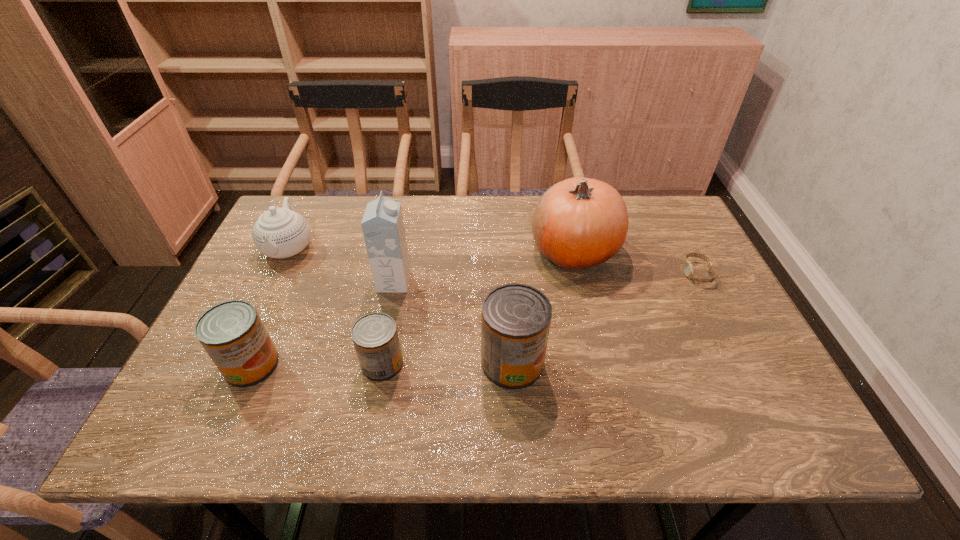
I want to click on free space located 0.150m on the back of the second tallest can, so click(282, 297).

Find the location of `free space located 0.110m on the back of the second can from left to right`. free space located 0.110m on the back of the second can from left to right is located at coordinates (393, 312).

At what (x,y) coordinates should I click in order to perform the action: click on vacant space situated on the left of the rightmost can. Please return your answer as a coordinate pair (x, y). Looking at the image, I should click on (432, 363).

Where is `blank space located on the front label of the carton`? This screenshot has width=960, height=540. blank space located on the front label of the carton is located at coordinates (444, 282).

I want to click on free space located on the right of the pumpkin, so click(643, 250).

Identify the location of vacant space located on the spout of the chinaware. The image size is (960, 540). (252, 325).

Where is `vacant region located on the face of the rightmost object`? vacant region located on the face of the rightmost object is located at coordinates (598, 273).

I want to click on vacant space positioned 0.130m on the face of the rightmost object, so click(636, 273).

You are a GUI agent. You are given a task and a screenshot of the screen. Output one action in this format:
    pyautogui.click(x=<x>, y=<y>)
    Task: Click on the vacant point located 0.090m on the face of the rightmost object
    
    Given the screenshot: What is the action you would take?
    pos(650,273)

This screenshot has height=540, width=960. In order to click on pumpkin positioned at the far edge in this screenshot , I will do `click(578, 223)`.